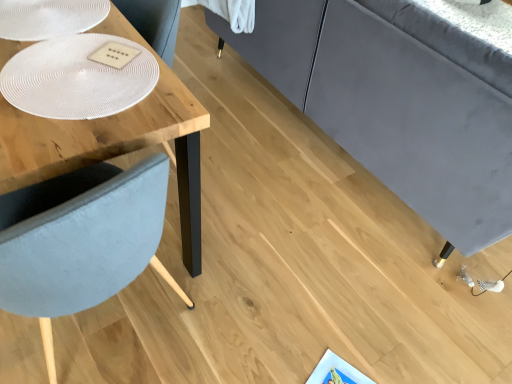
At what (x,y) coordinates should I click in order to perform the action: click on unoccupied region to the right of wooden table at left. Please return your answer as a coordinate pair (x, y). Looking at the image, I should click on (248, 183).